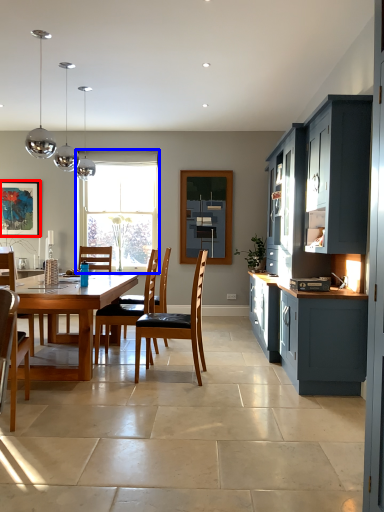
Question: Which object is closer to the camera taking this photo, picture frame (highlighted by a red box) or window (highlighted by a blue box)?

Choices:
 (A) picture frame
 (B) window

Answer: (A)